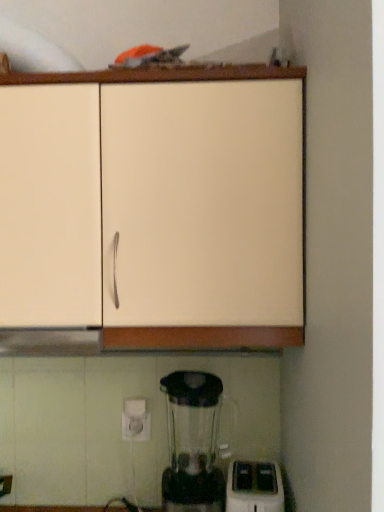
Identify the location of vacant area on top of white plastic toaster at lower right (from a real-world perspective). This screenshot has height=512, width=384. (253, 478).